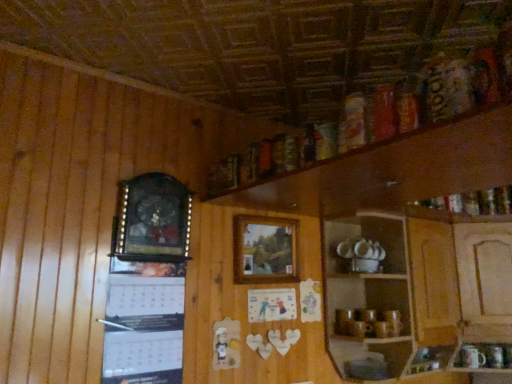
In order to face wooden cabinet at lower right, should I rotate leftwards or rightwards?

It's best to rotate right around 18.612 degrees.

Describe the element at coordinates (367, 296) in the screenshot. I see `wooden cabinet at lower right` at that location.

Measure the distance between white paper calendar at upper left and camera.

white paper calendar at upper left and camera are 4.82 feet apart.

Locate an element on the screen. Image resolution: width=512 pixels, height=384 pixels. wooden picture frame at center, which is counted as the second picture frame, starting from the front is located at coordinates (265, 250).

Describe the element at coordinates (152, 219) in the screenshot. The image size is (512, 384). I see `wooden picture frame at left, which appears as the second picture frame when viewed from the right` at that location.

Where is `wooden cabinet at lower right`? wooden cabinet at lower right is located at coordinates (367, 296).

Is the depth of white paper calendar at upper left less than that of wooden picture frame at center, marked as the 1th picture frame in a right-to-left arrangement?

Yes, the depth of white paper calendar at upper left is less than that of wooden picture frame at center, marked as the 1th picture frame in a right-to-left arrangement.

Is wooden picture frame at center, marked as the 1th picture frame in a right-to-left arrangement, at the back of white paper calendar at upper left?

white paper calendar at upper left does not have its back to wooden picture frame at center, marked as the 1th picture frame in a right-to-left arrangement.

From the image's perspective, is white paper calendar at upper left over wooden picture frame at center, the 1th picture frame when ordered from back to front?

Actually, white paper calendar at upper left appears below wooden picture frame at center, the 1th picture frame when ordered from back to front, in the image.

Which object is thinner, wooden picture frame at center, the 1th picture frame when ordered from back to front, or wooden picture frame at left, the 1th picture frame in the front-to-back sequence?

wooden picture frame at center, the 1th picture frame when ordered from back to front, is thinner.

This screenshot has height=384, width=512. Find the location of `picture frame that appears above the wooden picture frame at center, marked as the 1th picture frame in a right-to-left arrangement (from the image's perspective)`. picture frame that appears above the wooden picture frame at center, marked as the 1th picture frame in a right-to-left arrangement (from the image's perspective) is located at coordinates (152, 219).

Based on the photo, is wooden picture frame at center, marked as the 1th picture frame in a right-to-left arrangement, situated inside wooden picture frame at left, which ranks as the 1th picture frame in left-to-right order, or outside?

The correct answer is: outside.

Between wooden picture frame at center, which is counted as the second picture frame, starting from the front, and wooden picture frame at left, the 2th picture frame viewed from the back, which one appears on the left side from the viewer's perspective?

Positioned to the left is wooden picture frame at left, the 2th picture frame viewed from the back.

Considering their positions, is white paper calendar at upper left located in front of or behind wooden cabinet at lower right?

white paper calendar at upper left is in front of wooden cabinet at lower right.

Is white paper calendar at upper left far from wooden cabinet at lower right?

No, there isn't a large distance between white paper calendar at upper left and wooden cabinet at lower right.

Considering the positions of objects white paper calendar at upper left and wooden cabinet at lower right in the image provided, who is more to the right, white paper calendar at upper left or wooden cabinet at lower right?

wooden cabinet at lower right.

Which is behind, wooden cabinet at lower right or wooden picture frame at left, the 1th picture frame in the front-to-back sequence?

Positioned behind is wooden cabinet at lower right.

Can you confirm if wooden cabinet at lower right is shorter than wooden picture frame at left, the 1th picture frame in the front-to-back sequence?

No.

The width and height of the screenshot is (512, 384). What are the coordinates of `picture frame that is the 2nd one above the wooden cabinet at lower right (from a real-world perspective)` in the screenshot? It's located at (152, 219).

Is wooden cabinet at lower right thinner than wooden picture frame at left, the 1th picture frame in the front-to-back sequence?

No, wooden cabinet at lower right is not thinner than wooden picture frame at left, the 1th picture frame in the front-to-back sequence.

From the image's perspective, is wooden picture frame at center, the 1th picture frame when ordered from back to front, located above or below wooden cabinet at lower right?

wooden picture frame at center, the 1th picture frame when ordered from back to front, is situated higher than wooden cabinet at lower right in the image.

Can you tell me how much wooden picture frame at center, the 2th picture frame in the left-to-right sequence, and wooden cabinet at lower right differ in facing direction?

wooden picture frame at center, the 2th picture frame in the left-to-right sequence, and wooden cabinet at lower right are facing 0.114 degrees away from each other.

Considering the sizes of objects wooden picture frame at center, marked as the 1th picture frame in a right-to-left arrangement, and wooden cabinet at lower right in the image provided, who is wider, wooden picture frame at center, marked as the 1th picture frame in a right-to-left arrangement, or wooden cabinet at lower right?

Wider between the two is wooden cabinet at lower right.

Are wooden picture frame at left, the 2th picture frame viewed from the back, and wooden picture frame at center, which is counted as the second picture frame, starting from the front, far apart?

No, wooden picture frame at left, the 2th picture frame viewed from the back, is in close proximity to wooden picture frame at center, which is counted as the second picture frame, starting from the front.

Can you confirm if wooden picture frame at left, the 1th picture frame in the front-to-back sequence, is smaller than wooden picture frame at center, the 2th picture frame in the left-to-right sequence?

Actually, wooden picture frame at left, the 1th picture frame in the front-to-back sequence, might be larger than wooden picture frame at center, the 2th picture frame in the left-to-right sequence.

From the image's perspective, is wooden picture frame at left, the 1th picture frame in the front-to-back sequence, above or below wooden picture frame at center, the 2th picture frame in the left-to-right sequence?

wooden picture frame at left, the 1th picture frame in the front-to-back sequence, is situated higher than wooden picture frame at center, the 2th picture frame in the left-to-right sequence, in the image.

Can wooden picture frame at center, which is counted as the second picture frame, starting from the front, be found inside wooden picture frame at left, which appears as the second picture frame when viewed from the right?

Definitely not — wooden picture frame at center, which is counted as the second picture frame, starting from the front, is not inside wooden picture frame at left, which appears as the second picture frame when viewed from the right.

Is wooden picture frame at left, which ranks as the 1th picture frame in left-to-right order, taller or shorter than white paper calendar at upper left?

In the image, wooden picture frame at left, which ranks as the 1th picture frame in left-to-right order, appears to be shorter than white paper calendar at upper left.

Considering the sizes of objects wooden picture frame at left, which appears as the second picture frame when viewed from the right, and white paper calendar at upper left in the image provided, who is bigger, wooden picture frame at left, which appears as the second picture frame when viewed from the right, or white paper calendar at upper left?

Bigger between the two is wooden picture frame at left, which appears as the second picture frame when viewed from the right.

Is wooden picture frame at left, the 1th picture frame in the front-to-back sequence, positioned before white paper calendar at upper left?

No, wooden picture frame at left, the 1th picture frame in the front-to-back sequence, is further to the viewer.

From a real-world perspective, is wooden picture frame at left, the 1th picture frame in the front-to-back sequence, positioned over white paper calendar at upper left based on gravity?

Indeed, from a real-world perspective, wooden picture frame at left, the 1th picture frame in the front-to-back sequence, stands above white paper calendar at upper left.

Find the location of `bulletin board that appears below the wooden picture frame at center, the 2th picture frame in the left-to-right sequence (from the image's perspective)`. bulletin board that appears below the wooden picture frame at center, the 2th picture frame in the left-to-right sequence (from the image's perspective) is located at coordinates (144, 323).

I want to click on picture frame behind the wooden picture frame at left, which appears as the second picture frame when viewed from the right, so click(x=265, y=250).

Considering their positions, is wooden picture frame at center, the 2th picture frame in the left-to-right sequence, positioned further to white paper calendar at upper left than wooden cabinet at lower right?

wooden cabinet at lower right lies further to white paper calendar at upper left than the other object.

Looking at the image, which one is located closer to wooden cabinet at lower right, white paper calendar at upper left or wooden picture frame at left, the 2th picture frame viewed from the back?

white paper calendar at upper left lies closer to wooden cabinet at lower right than the other object.

Looking at the image, which one is located closer to wooden picture frame at center, the 1th picture frame when ordered from back to front, white paper calendar at upper left or wooden picture frame at left, the 1th picture frame in the front-to-back sequence?

Based on the image, wooden picture frame at left, the 1th picture frame in the front-to-back sequence, appears to be nearer to wooden picture frame at center, the 1th picture frame when ordered from back to front.

Looking at the image, which one is located further to white paper calendar at upper left, wooden cabinet at lower right or wooden picture frame at center, the 2th picture frame in the left-to-right sequence?

Based on the image, wooden cabinet at lower right appears to be further to white paper calendar at upper left.

In the scene shown: When comparing their distances from wooden cabinet at lower right, does wooden picture frame at left, the 2th picture frame viewed from the back, or wooden picture frame at center, the 1th picture frame when ordered from back to front, seem closer?

wooden picture frame at center, the 1th picture frame when ordered from back to front.

Considering their positions, is wooden picture frame at center, the 1th picture frame when ordered from back to front, positioned further to white paper calendar at upper left than wooden picture frame at left, which appears as the second picture frame when viewed from the right?

The object further to white paper calendar at upper left is wooden picture frame at center, the 1th picture frame when ordered from back to front.

Based on the photo, estimate the real-world distances between objects in this image. Which object is closer to white paper calendar at upper left, wooden picture frame at left, the 1th picture frame in the front-to-back sequence, or wooden picture frame at center, which is counted as the second picture frame, starting from the front?

wooden picture frame at left, the 1th picture frame in the front-to-back sequence, is closer to white paper calendar at upper left.

Based on their spatial positions, is wooden cabinet at lower right or wooden picture frame at left, which ranks as the 1th picture frame in left-to-right order, closer to wooden picture frame at center, marked as the 1th picture frame in a right-to-left arrangement?

wooden picture frame at left, which ranks as the 1th picture frame in left-to-right order, lies closer to wooden picture frame at center, marked as the 1th picture frame in a right-to-left arrangement, than the other object.

At what (x,y) coordinates should I click in order to perform the action: click on picture frame between wooden picture frame at left, the 2th picture frame viewed from the back, and wooden cabinet at lower right. Please return your answer as a coordinate pair (x, y). The height and width of the screenshot is (384, 512). Looking at the image, I should click on (265, 250).

Find the location of a particular element. The width and height of the screenshot is (512, 384). picture frame between white paper calendar at upper left and wooden picture frame at center, which is counted as the second picture frame, starting from the front, in the horizontal direction is located at coordinates (152, 219).